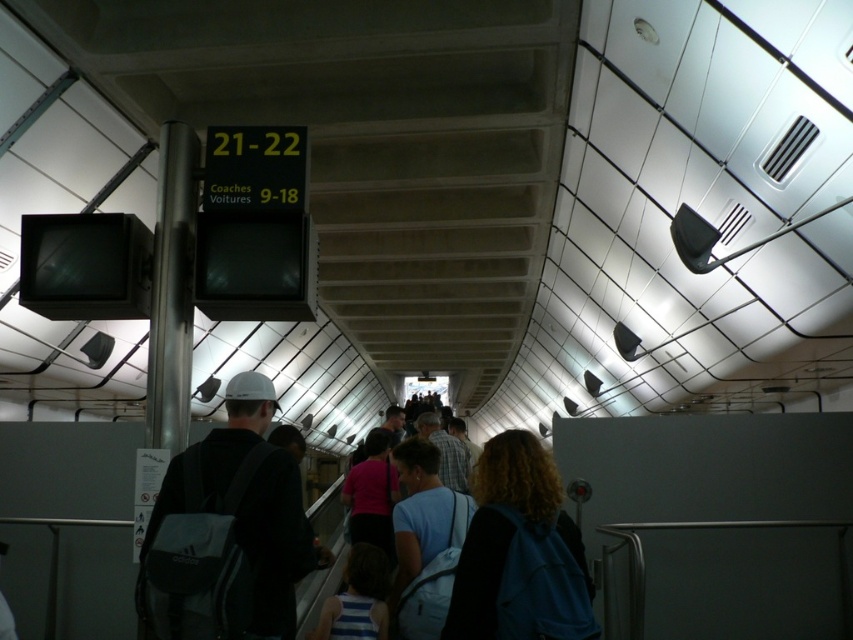
Question: Considering the relative positions of black fabric backpack at center and blue backpack at center in the image provided, where is black fabric backpack at center located with respect to blue backpack at center?

Choices:
 (A) right
 (B) left

Answer: (B)

Question: Is black fabric backpack at center smaller than blue backpack at center?

Choices:
 (A) yes
 (B) no

Answer: (B)

Question: Observing the image, what is the correct spatial positioning of black fabric backpack at center in reference to blue backpack at center?

Choices:
 (A) below
 (B) above

Answer: (A)

Question: Which of the following is the closest to the observer?

Choices:
 (A) black fabric backpack at center
 (B) blue backpack at center

Answer: (B)